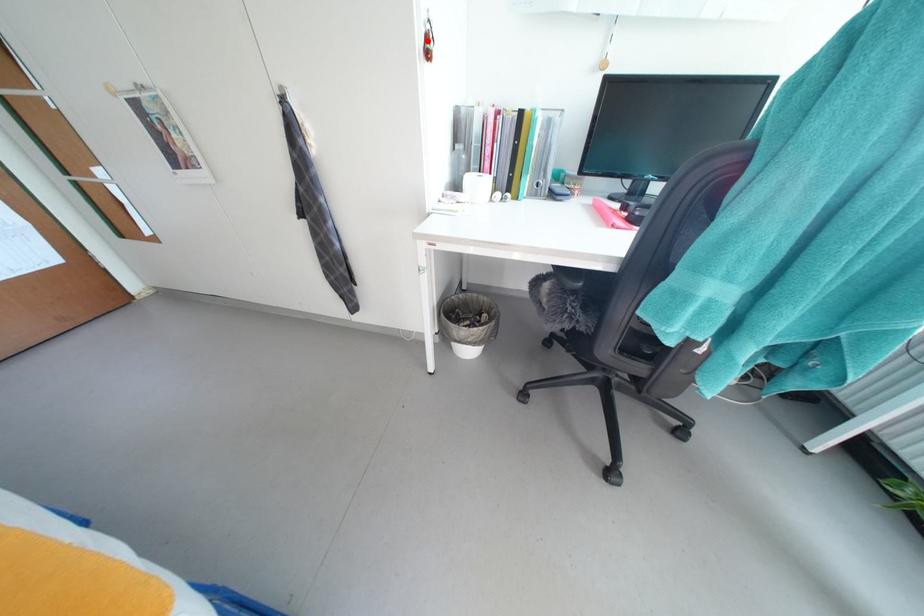
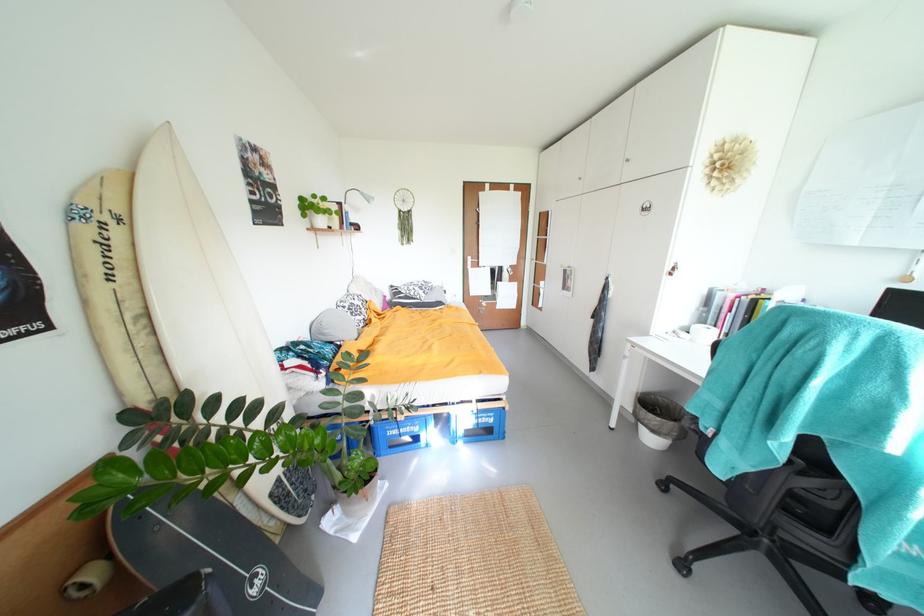
Where in the second image is the point corresponding to the highlighted location from the first image?

(675, 270)